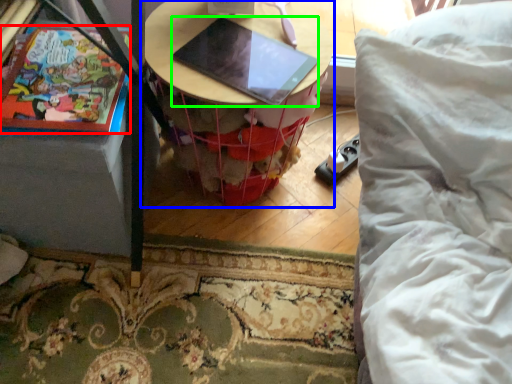
Question: Estimate the real-world distances between objects in this image. Which object is closer to comic book (highlighted by a red box), table (highlighted by a blue box) or laptop (highlighted by a green box)?

Choices:
 (A) table
 (B) laptop

Answer: (B)